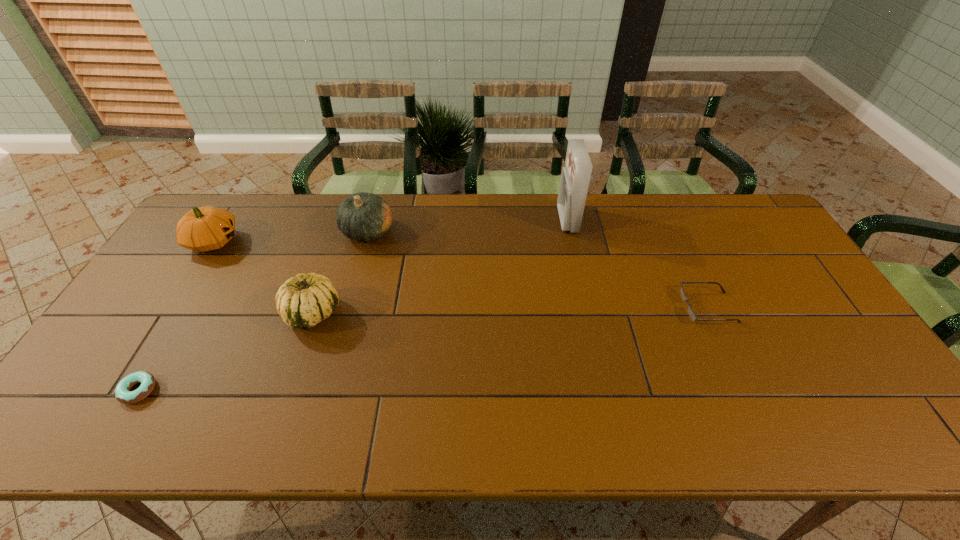
Identify the location of vacant space situated 0.170m on the front-facing side of the first-aid kit. (509, 220).

Find the location of a particular element. The width and height of the screenshot is (960, 540). free space located 0.350m on the side of the leftmost gourd with the carved face is located at coordinates (349, 241).

Locate an element on the screen. vacant space located 0.290m on the right of the nearest gourd is located at coordinates (447, 313).

Where is `vacant region located on the front-facing side of the fifth tallest object`? This screenshot has width=960, height=540. vacant region located on the front-facing side of the fifth tallest object is located at coordinates (575, 308).

Where is `free space located on the front-facing side of the fifth tallest object`? This screenshot has width=960, height=540. free space located on the front-facing side of the fifth tallest object is located at coordinates click(x=608, y=308).

Identify the location of free space located 0.210m on the front-facing side of the fifth tallest object. (608, 308).

This screenshot has width=960, height=540. Identify the location of vacant space located 0.080m on the front of the nearest object. (108, 440).

Image resolution: width=960 pixels, height=540 pixels. In order to click on the first-aid kit that is positioned at the far edge in this screenshot , I will do `click(575, 177)`.

You are a GUI agent. You are given a task and a screenshot of the screen. Output one action in this format:
    pyautogui.click(x=<x>, y=<y>)
    Task: Click on the gourd that is at the left edge
    
    Given the screenshot: What is the action you would take?
    pyautogui.click(x=202, y=229)

Identify the location of doughnut that is at the left edge. This screenshot has width=960, height=540. (122, 394).